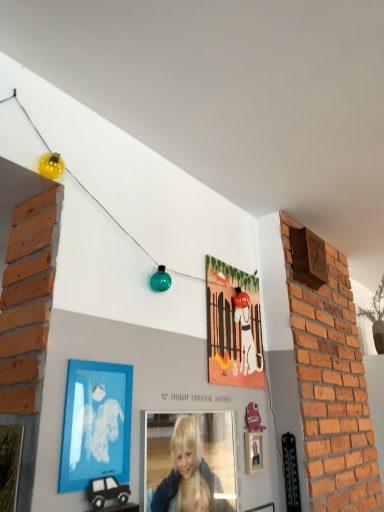
Question: Does smooth blonde hair at center touch blue matte picture frame at lower left, which appears as the second picture frame when viewed from the left?

Choices:
 (A) no
 (B) yes

Answer: (A)

Question: From the image's perspective, would you say smooth blonde hair at center is positioned over blue matte picture frame at lower left, which appears as the second picture frame when viewed from the left?

Choices:
 (A) no
 (B) yes

Answer: (A)

Question: From a real-world perspective, is smooth blonde hair at center positioned under blue matte picture frame at lower left, which appears as the second picture frame when viewed from the left, based on gravity?

Choices:
 (A) yes
 (B) no

Answer: (A)

Question: Is the position of smooth blonde hair at center more distant than that of blue matte picture frame at lower left, which appears as the second picture frame when viewed from the left?

Choices:
 (A) no
 (B) yes

Answer: (B)

Question: Considering the relative sizes of smooth blonde hair at center and blue matte picture frame at lower left, which is the 3th picture frame in right-to-left order, in the image provided, is smooth blonde hair at center taller than blue matte picture frame at lower left, which is the 3th picture frame in right-to-left order,?

Choices:
 (A) no
 (B) yes

Answer: (B)

Question: Choose the correct answer: Is wooden picture frame at lower left, marked as the fourth picture frame in a back-to-front arrangement, inside wooden picture frame at lower center, which is the third picture frame in front-to-back order, or outside it?

Choices:
 (A) outside
 (B) inside

Answer: (A)

Question: Considering the relative positions of wooden picture frame at lower left, placed as the 4th picture frame when sorted from right to left, and wooden picture frame at lower center, which is the 2th picture frame from back to front, in the image provided, is wooden picture frame at lower left, placed as the 4th picture frame when sorted from right to left, to the left or to the right of wooden picture frame at lower center, which is the 2th picture frame from back to front,?

Choices:
 (A) left
 (B) right

Answer: (A)

Question: Is wooden picture frame at lower left, the 1th picture frame in the front-to-back sequence, taller or shorter than wooden picture frame at lower center, the fourth picture frame from the left?

Choices:
 (A) tall
 (B) short

Answer: (A)

Question: From the image's perspective, is wooden picture frame at lower left, marked as the fourth picture frame in a back-to-front arrangement, positioned above or below wooden picture frame at lower center, the fourth picture frame from the left?

Choices:
 (A) above
 (B) below

Answer: (A)

Question: Is wooden picture frame at lower left, placed as the 4th picture frame when sorted from right to left, to the left or to the right of matte paper picture frame at center, which appears as the first picture frame when viewed from the back, in the image?

Choices:
 (A) right
 (B) left

Answer: (B)

Question: Is wooden picture frame at lower left, placed as the 4th picture frame when sorted from right to left, inside or outside of matte paper picture frame at center, which is counted as the 4th picture frame, starting from the front?

Choices:
 (A) inside
 (B) outside

Answer: (B)

Question: Relative to matte paper picture frame at center, arranged as the 3th picture frame when viewed from the left, is wooden picture frame at lower left, which appears as the first picture frame when viewed from the left, in front or behind?

Choices:
 (A) front
 (B) behind

Answer: (A)

Question: From the image's perspective, relative to matte paper picture frame at center, the second picture frame when ordered from right to left, is wooden picture frame at lower left, marked as the fourth picture frame in a back-to-front arrangement, above or below?

Choices:
 (A) below
 (B) above

Answer: (A)

Question: From a real-world perspective, is smooth blonde hair at center above or below matte paper picture frame at center, the second picture frame when ordered from right to left?

Choices:
 (A) above
 (B) below

Answer: (B)

Question: Does point pos(152,438) appear closer or farther from the camera than point pos(210,307)?

Choices:
 (A) farther
 (B) closer

Answer: (B)